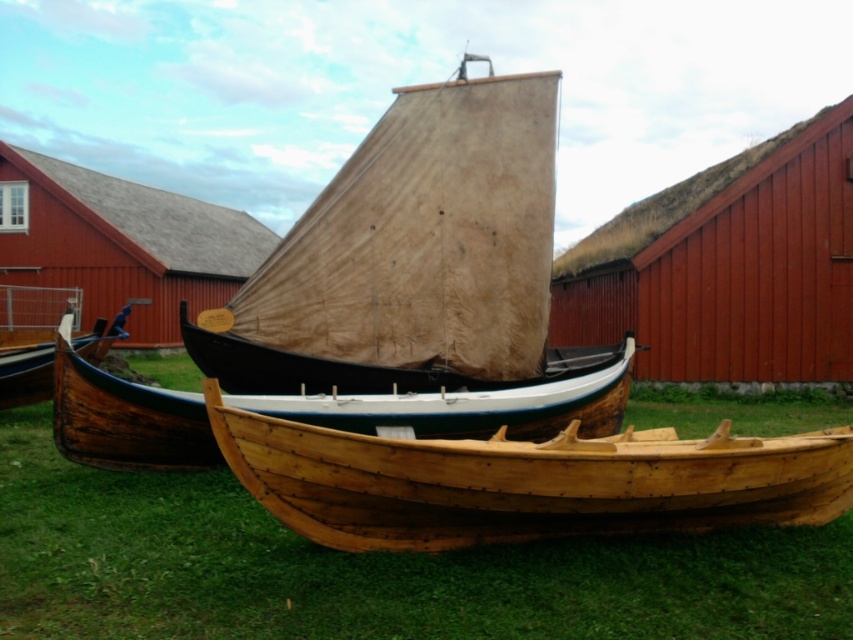
Question: Is natural wood canoe at center positioned at the back of wooden canoe at center?

Choices:
 (A) yes
 (B) no

Answer: (B)

Question: Which point appears farthest from the camera in this image?

Choices:
 (A) (26, 362)
 (B) (386, 324)
 (C) (131, 636)

Answer: (A)

Question: Which point is farther to the camera?

Choices:
 (A) natural wood canoe at center
 (B) beige canvas sailboat at center

Answer: (B)

Question: Which point is closer to the camera taking this photo?

Choices:
 (A) (387, 444)
 (B) (67, 397)

Answer: (A)

Question: Does natural wood boat at center have a lesser width compared to wooden canoe at lower left?

Choices:
 (A) yes
 (B) no

Answer: (B)

Question: Is natural wood canoe at center behind wooden canoe at center?

Choices:
 (A) yes
 (B) no

Answer: (B)